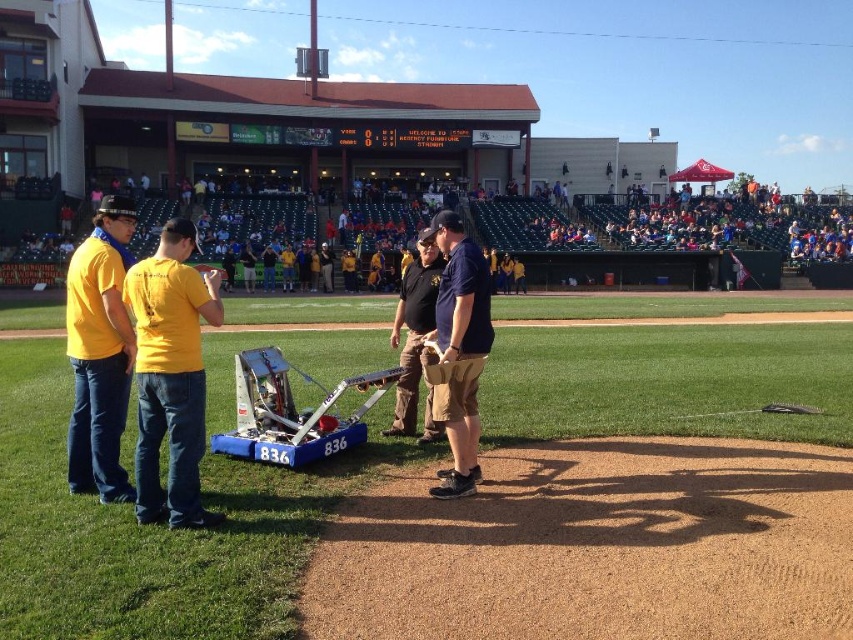
Question: Which of these objects is positioned farthest from the black leather jacket at center?

Choices:
 (A) yellow matte shirt at left
 (B) matte yellow shirt at left
 (C) dark blue uniform at center

Answer: (B)

Question: Based on their relative distances, which object is nearer to the black leather jacket at center?

Choices:
 (A) yellow matte shirt at left
 (B) dark blue uniform at center
 (C) matte yellow shirt at left

Answer: (B)

Question: Does matte yellow shirt at left appear under dark blue uniform at center?

Choices:
 (A) no
 (B) yes

Answer: (A)

Question: Estimate the real-world distances between objects in this image. Which object is closer to the black leather jacket at center?

Choices:
 (A) matte yellow shirt at left
 (B) yellow matte shirt at left
 (C) dark blue uniform at center

Answer: (C)

Question: Does yellow matte shirt at left appear over matte yellow shirt at left?

Choices:
 (A) yes
 (B) no

Answer: (B)

Question: Does matte yellow shirt at left come in front of black leather jacket at center?

Choices:
 (A) yes
 (B) no

Answer: (A)